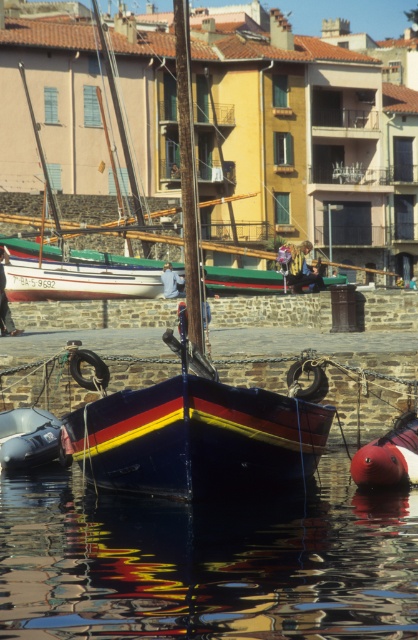
Question: Among these objects, which one is nearest to the camera?

Choices:
 (A) rubber red buoy at lower right
 (B) metallic blue boat at lower left
 (C) multicolored wooden boat at center

Answer: (A)

Question: Estimate the real-world distances between objects in this image. Which object is farther from the rubber red buoy at lower right?

Choices:
 (A) multicolored wooden boat at center
 (B) glossy water at center

Answer: (A)

Question: Can you confirm if glossy water at center is positioned below rubber red buoy at lower right?

Choices:
 (A) no
 (B) yes

Answer: (B)

Question: Is multicolored wooden boat at center thinner than rubber red buoy at lower right?

Choices:
 (A) no
 (B) yes

Answer: (A)

Question: Does multicolored wooden boat at center appear over rubber red buoy at lower right?

Choices:
 (A) yes
 (B) no

Answer: (A)

Question: Among these objects, which one is nearest to the camera?

Choices:
 (A) multicolored wooden boat at center
 (B) glossy water at center

Answer: (B)